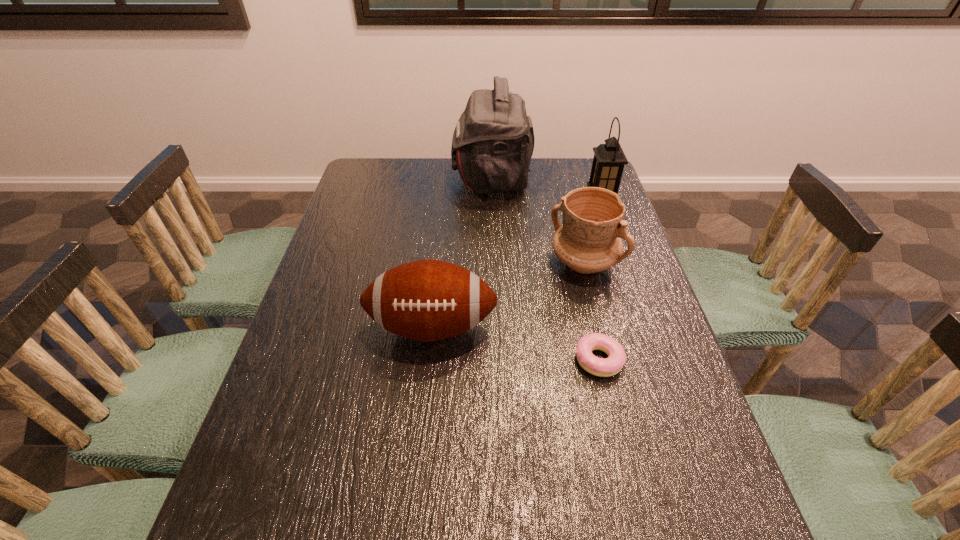
Where is `vacant space at the right edge of the desktop`? The image size is (960, 540). vacant space at the right edge of the desktop is located at coordinates (626, 292).

The height and width of the screenshot is (540, 960). Identify the location of blank space at the far right corner of the desktop. (562, 163).

The image size is (960, 540). I want to click on blank area at the near right corner, so coord(725,538).

I want to click on free spot between the pottery and the doughnut, so click(591, 311).

Identify the location of empty location between the fourth shortest object and the shortest object. This screenshot has height=540, width=960. (600, 279).

Image resolution: width=960 pixels, height=540 pixels. In order to click on free space between the second tallest object and the doughnut in this screenshot , I will do `click(600, 279)`.

Identify the location of free spot between the shortest object and the tallest object. (545, 269).

The width and height of the screenshot is (960, 540). I want to click on free space between the fourth shortest object and the shortest object, so click(600, 279).

In order to click on free area in between the fourth shortest object and the shoulder bag in this screenshot , I will do `click(546, 189)`.

The image size is (960, 540). I want to click on vacant space that's between the tallest object and the pottery, so click(x=538, y=221).